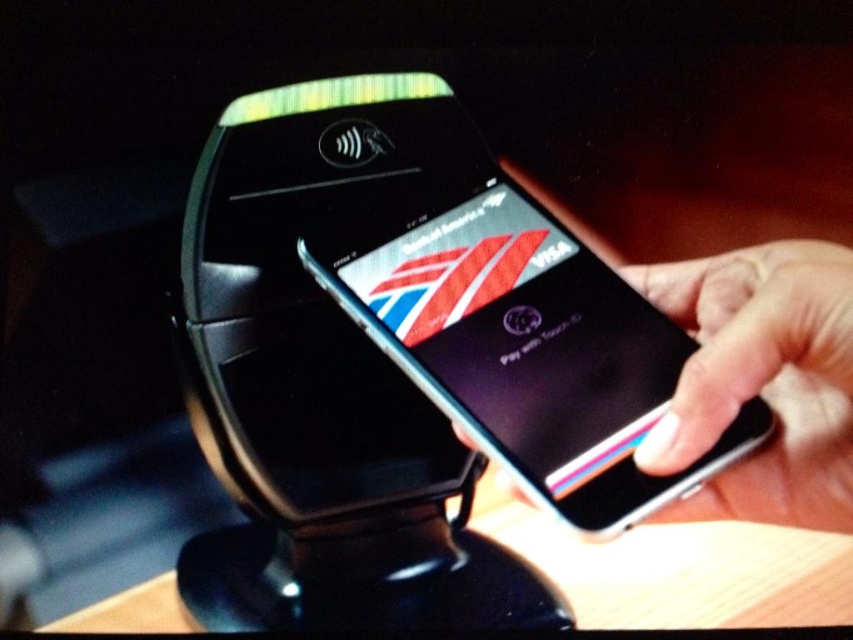
Between metallic silver smartphone at center and white matte phone at right, which one is positioned lower?

white matte phone at right is lower down.

Is point (556, 328) less distant than point (819, 442)?

That is False.

Who is more distant from viewer, (x=482, y=353) or (x=813, y=243)?

The point (x=813, y=243) is behind.

Locate an element on the screen. This screenshot has height=640, width=853. metallic silver smartphone at center is located at coordinates (524, 346).